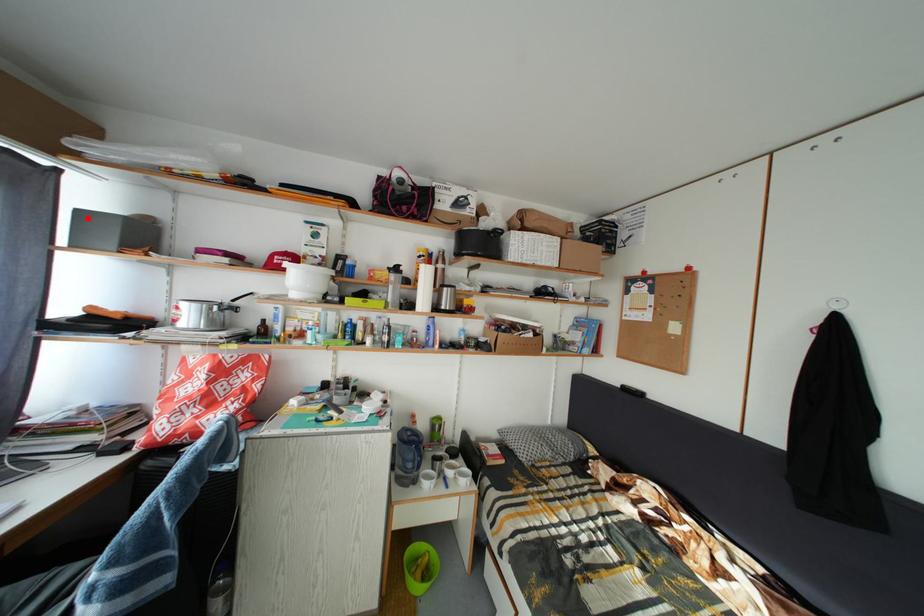
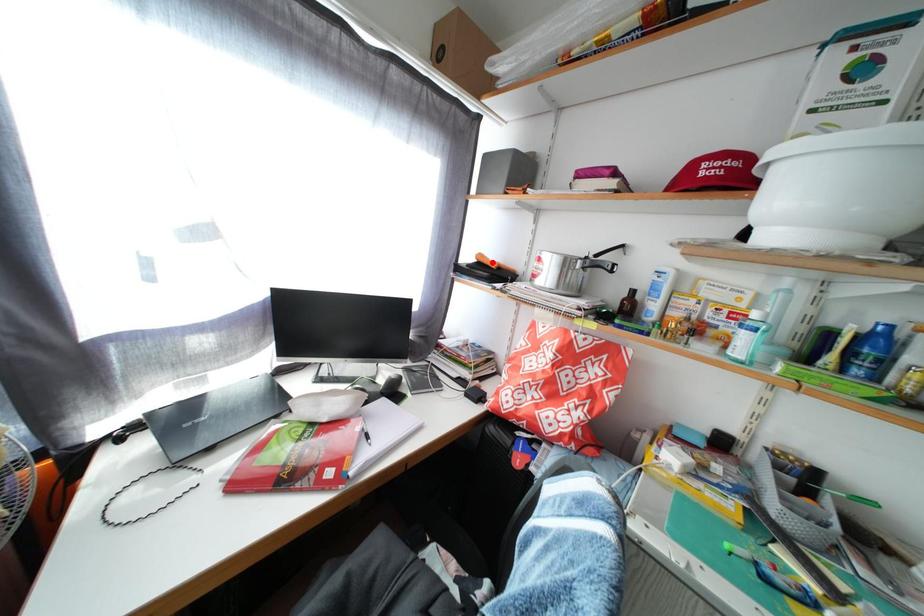
I am providing you with two images of the same scene from different viewpoints. A red point is marked on the first image and another point is marked on the second image. Do the highlighted points in image1 and image2 indicate the same real-world spot?

No